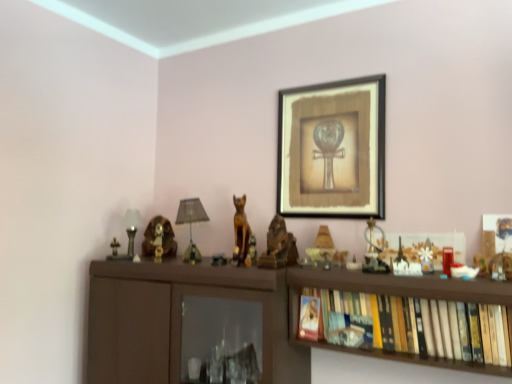
Question: Does wooden statue at center, marked as the first animal in a front-to-back arrangement, have a lesser width compared to matte silver table lamp at left, which appears as the 2th table lamp when viewed from the right?

Choices:
 (A) no
 (B) yes

Answer: (A)

Question: Can you confirm if wooden statue at center, the first animal when ordered from right to left, is bigger than matte silver table lamp at left, which is counted as the 1th table lamp, starting from the left?

Choices:
 (A) no
 (B) yes

Answer: (B)

Question: Can you confirm if wooden statue at center, positioned as the third animal in back-to-front order, is smaller than matte silver table lamp at left, which is counted as the 1th table lamp, starting from the left?

Choices:
 (A) yes
 (B) no

Answer: (B)

Question: Is wooden statue at center, positioned as the third animal in back-to-front order, completely or partially outside of matte silver table lamp at left, which appears as the 2th table lamp when viewed from the right?

Choices:
 (A) yes
 (B) no

Answer: (A)

Question: Is wooden statue at center, which appears as the 3th animal when viewed from the left, shorter than matte silver table lamp at left, which appears as the 2th table lamp when viewed from the right?

Choices:
 (A) yes
 (B) no

Answer: (A)

Question: Is wooden statue at center, which appears as the 3th animal when viewed from the left, directly adjacent to matte silver table lamp at left, which appears as the 2th table lamp when viewed from the right?

Choices:
 (A) no
 (B) yes

Answer: (A)

Question: Can you see matte silver table lamp at left, which appears as the 2th table lamp when viewed from the right, touching metallic gold figurine at left, the fifth toy viewed from the right?

Choices:
 (A) no
 (B) yes

Answer: (B)

Question: From a real-world perspective, is matte silver table lamp at left, which is counted as the 1th table lamp, starting from the left, on metallic gold figurine at left, the first toy from the left?

Choices:
 (A) no
 (B) yes

Answer: (B)

Question: Is matte silver table lamp at left, which appears as the 2th table lamp when viewed from the right, shorter than metallic gold figurine at left, the first toy from the left?

Choices:
 (A) no
 (B) yes

Answer: (A)

Question: Is matte silver table lamp at left, which is counted as the 1th table lamp, starting from the left, wider than metallic gold figurine at left, which is the 5th toy in front-to-back order?

Choices:
 (A) yes
 (B) no

Answer: (A)

Question: Can you confirm if matte silver table lamp at left, which appears as the 2th table lamp when viewed from the right, is smaller than metallic gold figurine at left, marked as the first toy in a back-to-front arrangement?

Choices:
 (A) yes
 (B) no

Answer: (B)

Question: Is metallic gold figurine at left, which is the 5th toy in front-to-back order, at the back of matte silver table lamp at left, which appears as the 2th table lamp when viewed from the right?

Choices:
 (A) no
 (B) yes

Answer: (A)

Question: Is metallic gold statue at center, which appears as the second toy when viewed from the back, aimed at wooden statue at center, which appears as the 3th animal when viewed from the left?

Choices:
 (A) yes
 (B) no

Answer: (B)